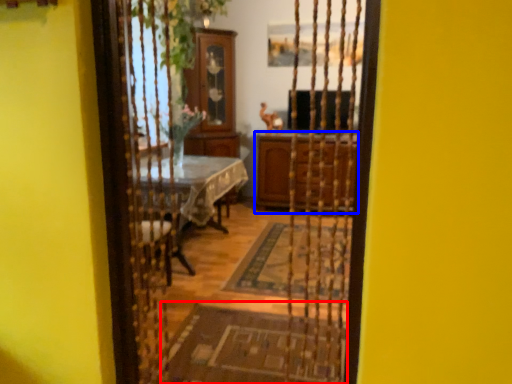
Question: Which object appears closest to the camera in this image, doormat (highlighted by a red box) or cabinetry (highlighted by a blue box)?

Choices:
 (A) doormat
 (B) cabinetry

Answer: (A)